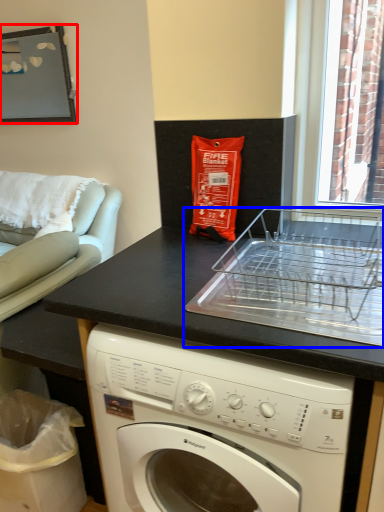
Question: Which of the following is the closest to the observer, picture frame (highlighted by a red box) or appliance (highlighted by a blue box)?

Choices:
 (A) picture frame
 (B) appliance

Answer: (B)